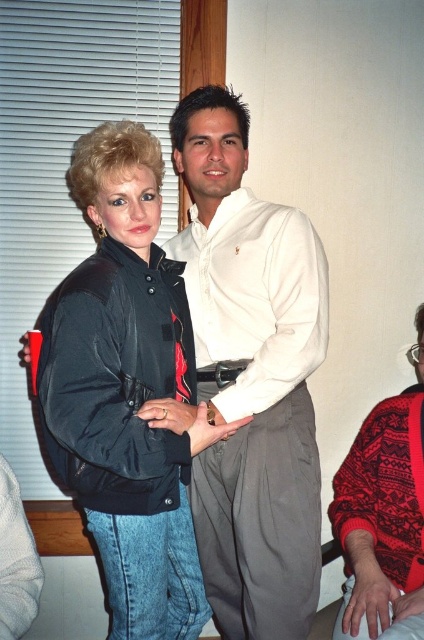
Question: Which object is positioned farthest from the black leather jacket at center?

Choices:
 (A) red knitted sweater at lower right
 (B) white smooth shirt at center

Answer: (A)

Question: Which point appears closest to the camera in this image?

Choices:
 (A) (382, 579)
 (B) (158, 465)

Answer: (B)

Question: Does black leather jacket at center appear on the left side of red knitted sweater at lower right?

Choices:
 (A) no
 (B) yes

Answer: (B)

Question: Which point is closer to the camera?

Choices:
 (A) red knitted sweater at lower right
 (B) white smooth shirt at center

Answer: (A)

Question: In this image, where is white smooth shirt at center located relative to red knitted sweater at lower right?

Choices:
 (A) left
 (B) right

Answer: (A)

Question: Does black leather jacket at center have a larger size compared to red knitted sweater at lower right?

Choices:
 (A) no
 (B) yes

Answer: (B)